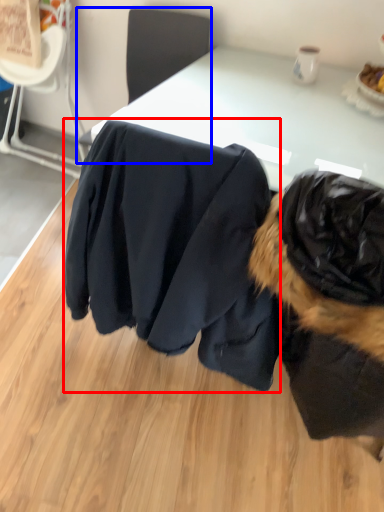
Question: Which object appears closest to the camera in this image, clothing (highlighted by a red box) or chair (highlighted by a blue box)?

Choices:
 (A) clothing
 (B) chair

Answer: (A)